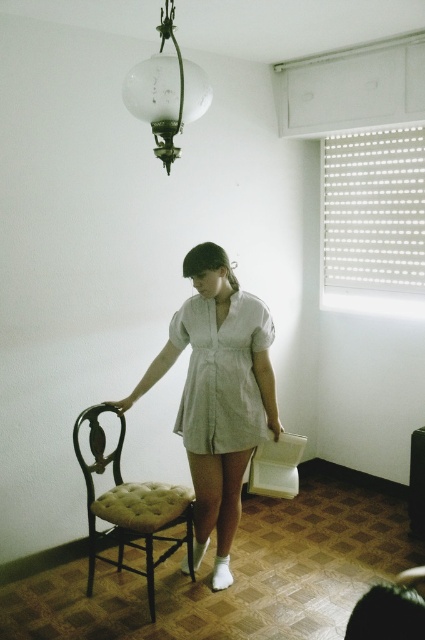
You are a fashion designer who wants to showcase the white cotton dress at center and the translucent glass globe at upper center in a photo shoot. Which object should be placed closer to the camera to maintain the same perspective as the original image?

The white cotton dress at center should be placed closer to the camera because it is further to the viewer than the translucent glass globe at upper center in the original image.

You are organizing a small event in the room and need to place a decorative item on the floor. The white cotton dress at center is currently in the way. Can you move it to make space without disturbing the translucent glass globe at upper center?

Yes, since the white cotton dress at center is below the translucent glass globe at upper center, you can move the white cotton dress at center to another location on the floor without affecting the position of the translucent glass globe at upper center.

You are a tailor trying to determine if the light green linen dress at center can fit inside the translucent glass globe at upper center. Based on their sizes, is this possible?

The light green linen dress at center might be wider than the translucent glass globe at upper center, so it may not fit inside.